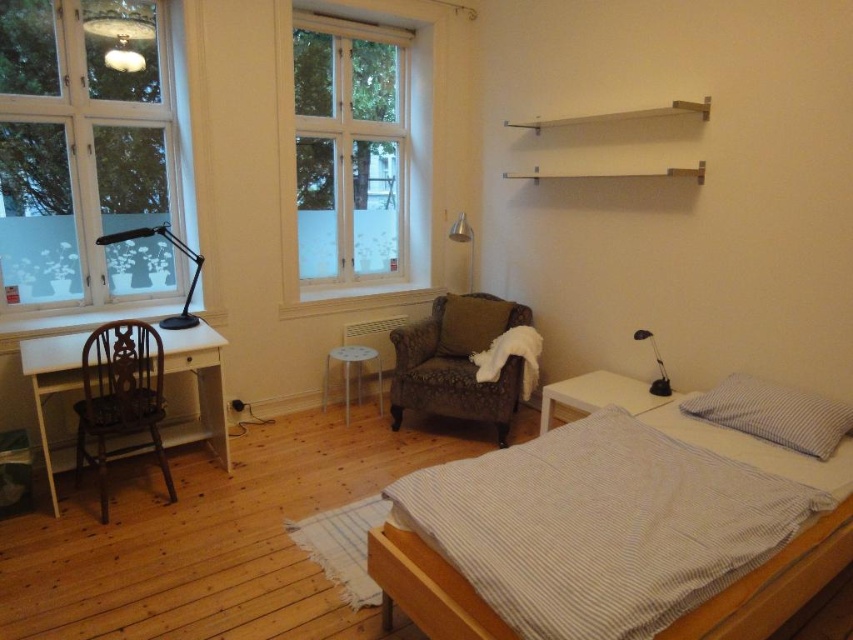
Looking at this image, you are organizing a small event in the room and need to place a 1.2 meter wide decorative panel. You have two options for placement locations based on the objects in the scene. The first option is next to the white matte window at upper center, and the second is next to the soft brown cushion at center. Which location would allow the panel to fit without exceeding the available space?

The white matte window at upper center has a larger width than the soft brown cushion at center, so placing the 1.2 meter wide decorative panel next to the white matte window at upper center would provide more space and ensure it fits without exceeding the available area.

You are standing in the room and want to take a photo of the white matte side table at lower right using a camera. The camera requires a minimum distance of 3 meters to avoid blurring. Can you take the photo without moving either the camera or the side table?

The white matte side table at lower right and camera are 2.99 meters apart, which is less than the required 3 meters. Therefore, you cannot take the photo without moving either the camera or the side table to avoid blurring.

You are moving furniture in the room and need to place the white plastic stool at center. Where should you move it so it is no longer under the white matte side table at lower right?

The white plastic stool at center is currently under the white matte side table at lower right. To move it out from under the table, you should relocate the white plastic stool at center to a position that is not beneath the white matte side table at lower right.